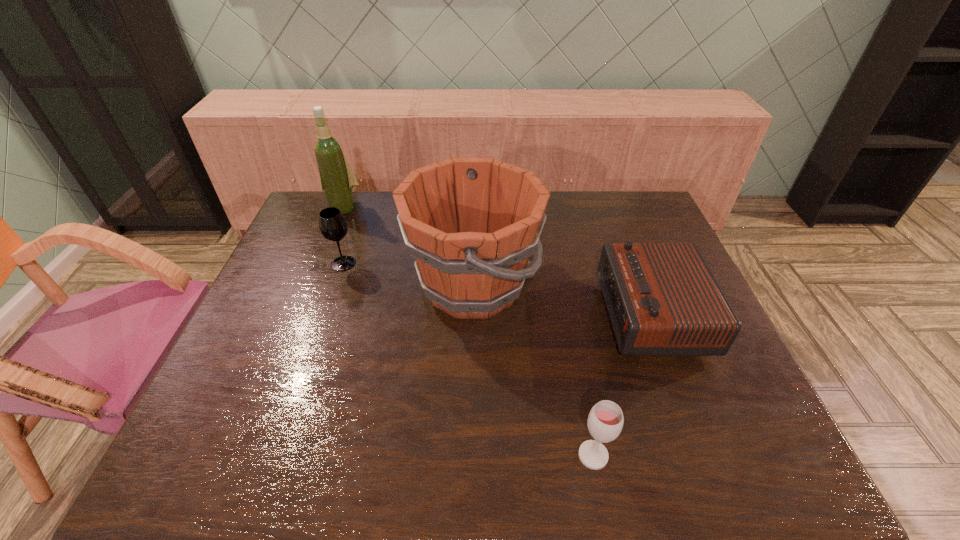
Locate an element on the screen. Image resolution: width=960 pixels, height=540 pixels. blank region between the rightmost object and the second object from right to left is located at coordinates (622, 386).

At what (x,y) coordinates should I click in order to perform the action: click on object identified as the second closest to the wine bottle. Please return your answer as a coordinate pair (x, y). Looking at the image, I should click on (471, 223).

Image resolution: width=960 pixels, height=540 pixels. I want to click on object identified as the third closest to the third object from left to right, so click(337, 179).

Locate an element on the screen. This screenshot has height=540, width=960. vacant position in the image that satisfies the following two spatial constraints: 1. on the front-facing side of the tallest object; 2. on the right side of the second object from right to left is located at coordinates (246, 455).